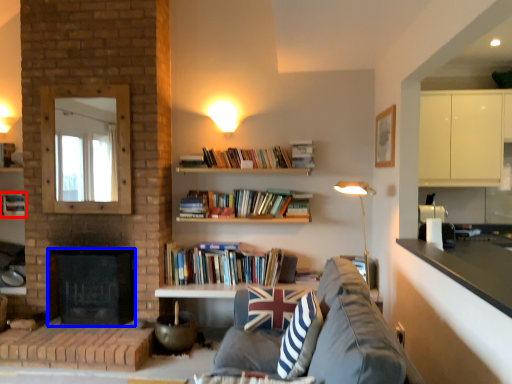
Question: Which of the following is the farthest to the observer, book (highlighted by a red box) or fireplace (highlighted by a blue box)?

Choices:
 (A) book
 (B) fireplace

Answer: (A)